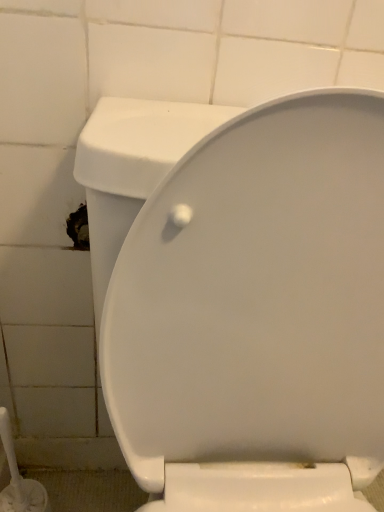
Where is `white plastic brush at lower left`? This screenshot has height=512, width=384. white plastic brush at lower left is located at coordinates (19, 479).

Describe the element at coordinates (19, 479) in the screenshot. Image resolution: width=384 pixels, height=512 pixels. I see `white plastic brush at lower left` at that location.

Find the location of `white glossy toilet at center`. white glossy toilet at center is located at coordinates (256, 314).

What do you see at coordinates (256, 314) in the screenshot?
I see `white glossy toilet at center` at bounding box center [256, 314].

Where is `white plastic brush at lower left`? Image resolution: width=384 pixels, height=512 pixels. white plastic brush at lower left is located at coordinates (19, 479).

Does white glossy toilet at center appear on the right side of white plastic brush at lower left?

Yes, white glossy toilet at center is to the right of white plastic brush at lower left.

Which object is closer to the camera, white glossy toilet at center or white plastic brush at lower left?

white glossy toilet at center is closer to the camera.

Does point (120, 273) come closer to viewer compared to point (11, 485)?

That is True.

From the image's perspective, is white glossy toilet at center above white plastic brush at lower left?

Correct, white glossy toilet at center appears higher than white plastic brush at lower left in the image.

From a real-world perspective, between white glossy toilet at center and white plastic brush at lower left, who is vertically lower?

white plastic brush at lower left, from a real-world perspective.

Which of these two, white glossy toilet at center or white plastic brush at lower left, is thinner?

Thinner between the two is white plastic brush at lower left.

From their relative heights in the image, would you say white glossy toilet at center is taller or shorter than white plastic brush at lower left?

In the image, white glossy toilet at center appears to be taller than white plastic brush at lower left.

In the scene shown: Which of these two, white glossy toilet at center or white plastic brush at lower left, is smaller?

white plastic brush at lower left.

Which is correct: white glossy toilet at center is inside white plastic brush at lower left, or outside of it?

white glossy toilet at center cannot be found inside white plastic brush at lower left.

In the scene shown: Are white glossy toilet at center and white plastic brush at lower left beside each other?

No, white glossy toilet at center is not making contact with white plastic brush at lower left.

Is white glossy toilet at center positioned with its back to white plastic brush at lower left?

No, white glossy toilet at center is not facing the opposite direction of white plastic brush at lower left.

What's the angular difference between white glossy toilet at center and white plastic brush at lower left's facing directions?

The facing directions of white glossy toilet at center and white plastic brush at lower left are 8.52e-05 degrees apart.

The height and width of the screenshot is (512, 384). I want to click on brush behind the white glossy toilet at center, so click(19, 479).

Between white plastic brush at lower left and white glossy toilet at center, which one appears on the right side from the viewer's perspective?

Positioned to the right is white glossy toilet at center.

Is the position of white plastic brush at lower left more distant than that of white glossy toilet at center?

Yes, it is behind white glossy toilet at center.

Considering the positions of point (2, 496) and point (343, 403), is point (2, 496) closer or farther from the camera than point (343, 403)?

Point (2, 496) is positioned farther from the camera compared to point (343, 403).

From the image's perspective, does white plastic brush at lower left appear higher than white glossy toilet at center?

No, from the image's perspective, white plastic brush at lower left is not over white glossy toilet at center.

From a real-world perspective, is white plastic brush at lower left physically above white glossy toilet at center?

No, from a real-world perspective, white plastic brush at lower left is not on top of white glossy toilet at center.

Based on the photo, does white plastic brush at lower left have a lesser width compared to white glossy toilet at center?

Yes.

From their relative heights in the image, would you say white plastic brush at lower left is taller or shorter than white glossy toilet at center?

white plastic brush at lower left is shorter than white glossy toilet at center.

Does white plastic brush at lower left have a larger size compared to white glossy toilet at center?

Actually, white plastic brush at lower left might be smaller than white glossy toilet at center.

Is white glossy toilet at center inside white plastic brush at lower left?

No, white glossy toilet at center is not a part of white plastic brush at lower left.

Does white plastic brush at lower left touch white glossy toilet at center?

white plastic brush at lower left is not next to white glossy toilet at center, and they're not touching.

Is white plastic brush at lower left facing towards white glossy toilet at center?

No, white plastic brush at lower left does not turn towards white glossy toilet at center.

The image size is (384, 512). What are the coordinates of `toilet on the right of white plastic brush at lower left` in the screenshot? It's located at (256, 314).

In order to click on brush on the left of white glossy toilet at center in this screenshot , I will do [x=19, y=479].

Where is `brush behind the white glossy toilet at center`? brush behind the white glossy toilet at center is located at coordinates (19, 479).